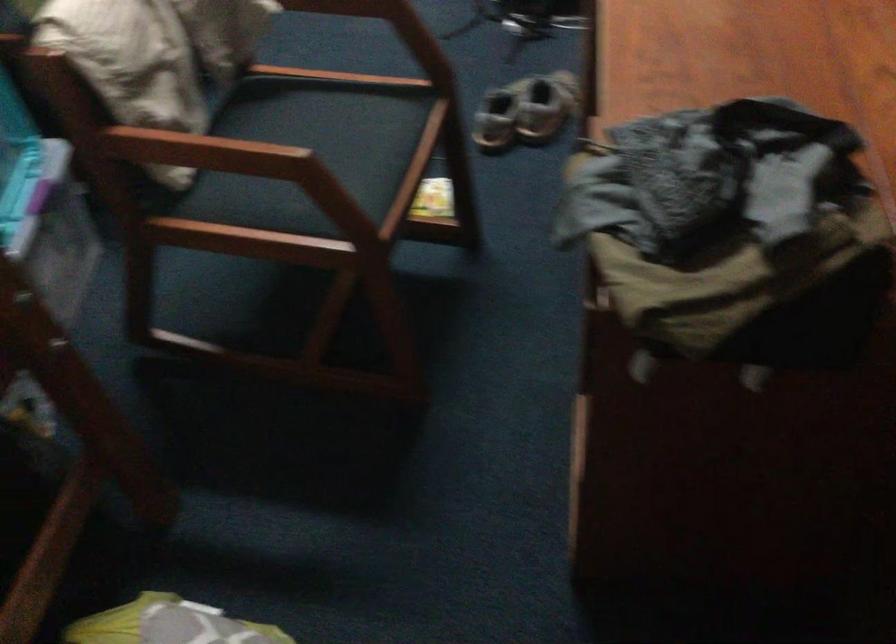
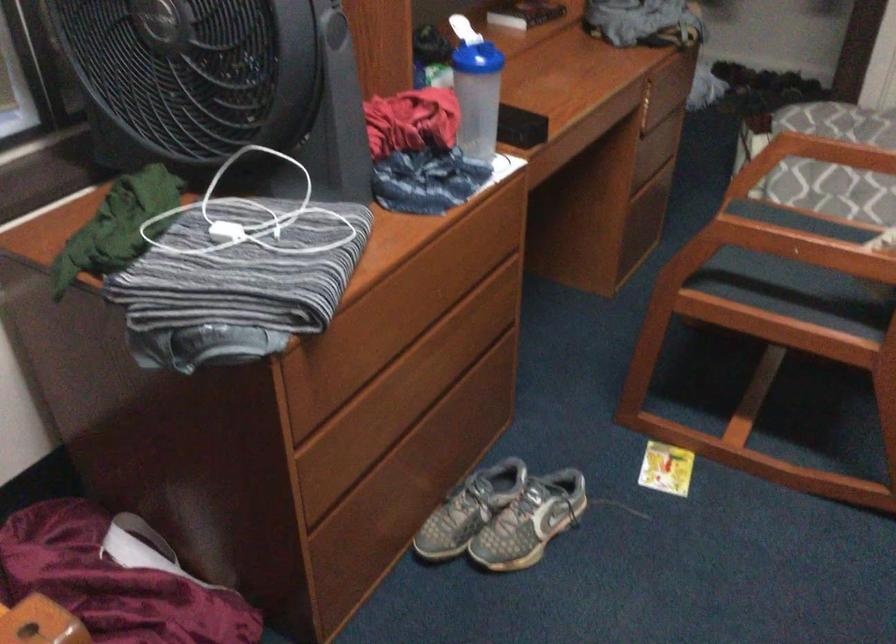
Where in the second image is the point corresponding to the point at 524,88 from the first image?

(503, 516)